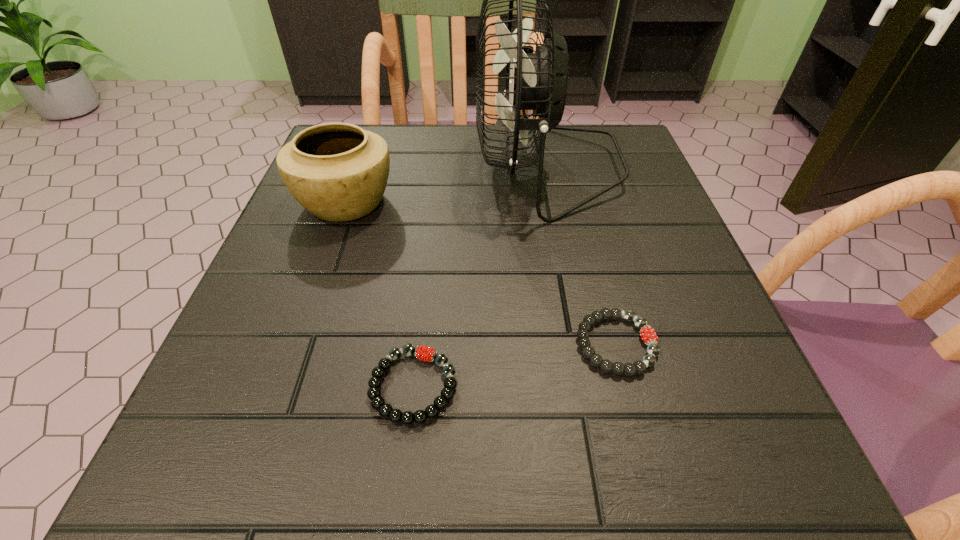
Where is `vacant area located on the back of the right bracelet`? The height and width of the screenshot is (540, 960). vacant area located on the back of the right bracelet is located at coordinates (572, 174).

The width and height of the screenshot is (960, 540). Find the location of `fan present at the far edge`. fan present at the far edge is located at coordinates (539, 80).

Where is `pottery located in the far edge section of the desktop`? The width and height of the screenshot is (960, 540). pottery located in the far edge section of the desktop is located at coordinates (338, 172).

You are a GUI agent. You are given a task and a screenshot of the screen. Output one action in this format:
    pyautogui.click(x=<x>, y=<y>)
    Task: Click on the object situated at the left edge
    The height and width of the screenshot is (540, 960).
    Given the screenshot: What is the action you would take?
    [338, 172]

This screenshot has height=540, width=960. I want to click on fan that is at the right edge, so click(539, 80).

Identify the location of bracelet present at the right edge. The image size is (960, 540). (647, 333).

The width and height of the screenshot is (960, 540). What are the coordinates of `object that is at the far left corner` in the screenshot? It's located at (338, 172).

Locate an element on the screen. The width and height of the screenshot is (960, 540). object present at the far right corner is located at coordinates (539, 80).

Find the location of `free space at the far edge`. free space at the far edge is located at coordinates (399, 172).

Where is `vacant area at the near edge`? The height and width of the screenshot is (540, 960). vacant area at the near edge is located at coordinates (610, 447).